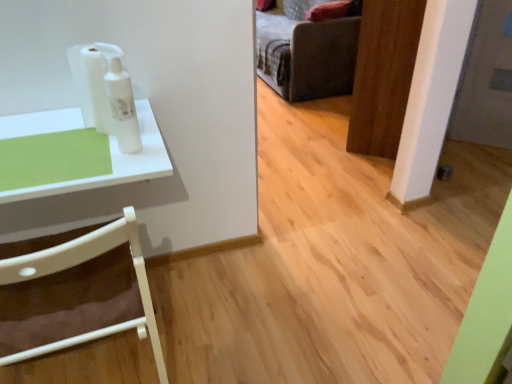
Question: Do you think dark gray fabric couch at upper center is within white plastic chair at left, or outside of it?

Choices:
 (A) outside
 (B) inside

Answer: (A)

Question: Looking at their shapes, would you say dark gray fabric couch at upper center is wider or thinner than white plastic chair at left?

Choices:
 (A) thin
 (B) wide

Answer: (B)

Question: Which of these objects is positioned farthest from the dark gray fabric couch at upper center?

Choices:
 (A) white plastic chair at left
 (B) white glossy lotion at upper left
 (C) wooden door at center

Answer: (A)

Question: Which of these objects is positioned closest to the white glossy lotion at upper left?

Choices:
 (A) white plastic chair at left
 (B) dark gray fabric couch at upper center
 (C) wooden door at center

Answer: (A)